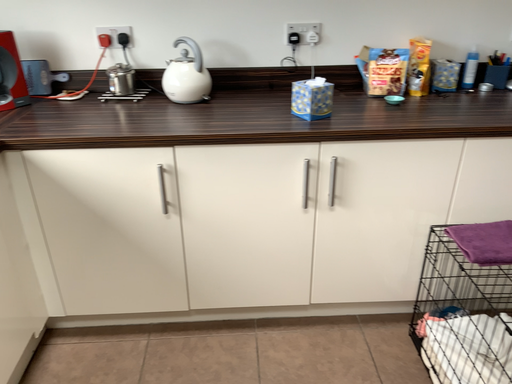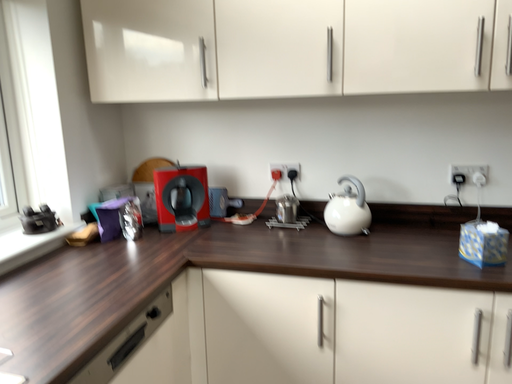
Question: How did the camera likely rotate when shooting the video?

Choices:
 (A) rotated left
 (B) rotated right

Answer: (A)